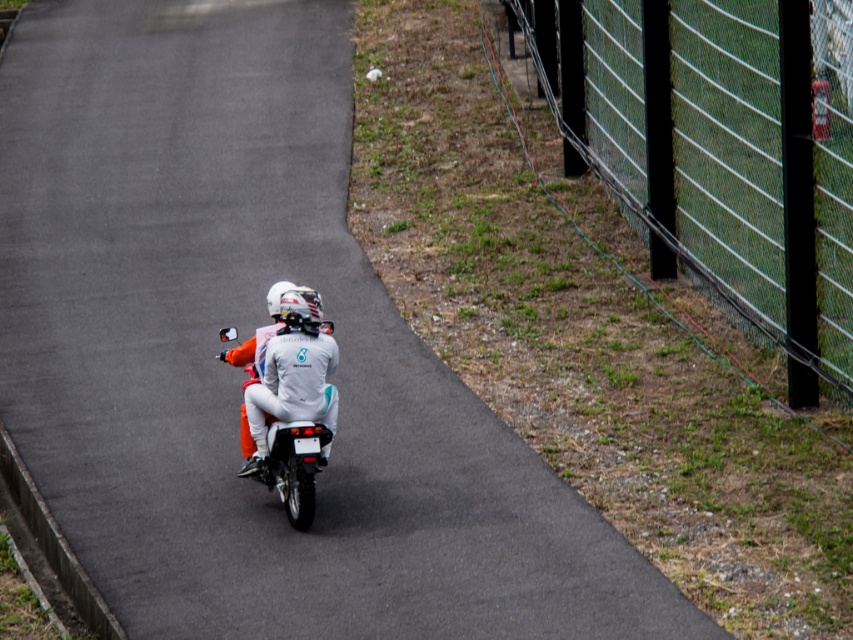
You are a pedestrian standing on the grassy area near the green mesh fence at right. You want to cross to the other side of the road. Is the white matte motorcycle at center blocking your path?

The white matte motorcycle at center is behind the green mesh fence at right, so it is not blocking your path. You can safely cross the road.

You are a drone operator trying to capture a photo of the motorcycle riders from above. The green mesh fence at right is in your shot. To avoid the fence, should you adjust your camera angle to the left or right?

The green mesh fence at right is located at point (717, 152), so adjusting the camera angle to the left would help avoid it.